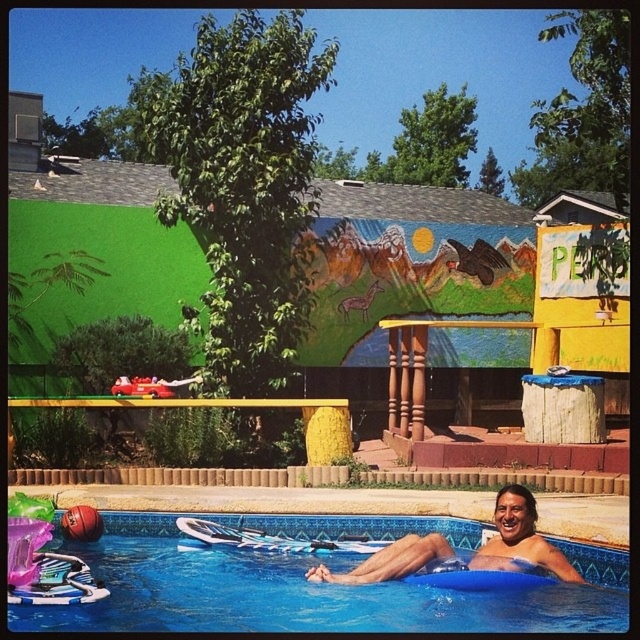
Looking at this image, you are a lifeguard standing at the edge of the pool. You notice a swimmer whose smooth tan skin at lower center is near the blue plastic pool at lower center. If the safety protocol requires a minimum distance of 18 inches between swimmers and the edge of the pool, is this swimmer violating the safety rule?

The distance between the smooth tan skin at lower center and the blue plastic pool at lower center is 16.76 inches, which is less than the required 18 inches. Therefore, the swimmer is violating the safety rule.

You are standing at the edge of the pool and want to reach the smooth tan skin at lower center without stepping into the water. Which direction should you move to from the blue plastic pool at lower center?

Since the blue plastic pool at lower center is to the left of the smooth tan skin at lower center, you should move to the right from the blue plastic pool at lower center to reach the smooth tan skin at lower center without entering the water.